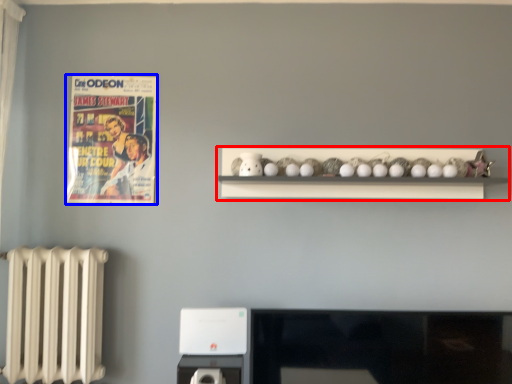
Question: Among these objects, which one is farthest to the camera, shelf (highlighted by a red box) or comic book (highlighted by a blue box)?

Choices:
 (A) shelf
 (B) comic book

Answer: (B)